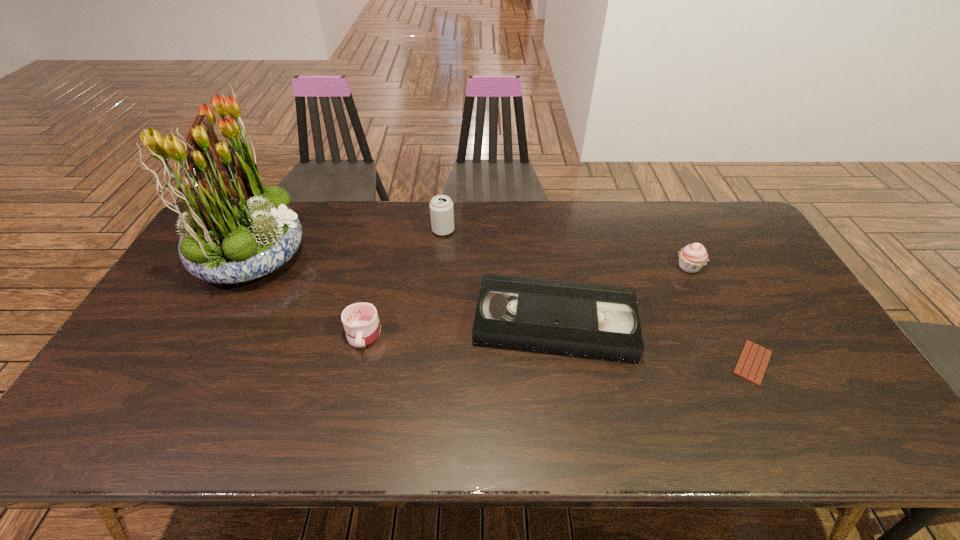
Where is `empty space between the candy bar and the cupcake`? The width and height of the screenshot is (960, 540). empty space between the candy bar and the cupcake is located at coordinates pos(721,315).

The image size is (960, 540). I want to click on free space between the second tallest object and the second object from left to right, so click(x=403, y=282).

This screenshot has height=540, width=960. I want to click on blank region between the mug and the flower arrangement, so click(x=308, y=295).

Locate which object is the fourth closest to the videotape. Please provide its 2D coordinates. Your answer should be formatted as a tuple, i.e. [(x, y)], where the tuple contains the x and y coordinates of a point satisfying the conditions above.

[(361, 323)]

You are a GUI agent. You are given a task and a screenshot of the screen. Output one action in this format:
    pyautogui.click(x=<x>, y=<y>)
    Task: Click on the object that is the second nearest to the third object from left to right
    
    Given the screenshot: What is the action you would take?
    pyautogui.click(x=361, y=323)

This screenshot has width=960, height=540. What are the coordinates of `vacant area in the image that satisfies the following two spatial constraints: 1. on the front-facing side of the tallest object; 2. on the right side of the fourth shortest object` in the screenshot? It's located at 246,267.

Locate an element on the screen. The width and height of the screenshot is (960, 540). free space that satisfies the following two spatial constraints: 1. on the front-facing side of the tallest object; 2. on the right side of the candy bar is located at coordinates (193, 363).

You are a GUI agent. You are given a task and a screenshot of the screen. Output one action in this format:
    pyautogui.click(x=<x>, y=<y>)
    Task: Click on the free location that satisfies the following two spatial constraints: 1. on the front side of the shortest object; 2. on the left side of the can
    The width and height of the screenshot is (960, 540).
    Given the screenshot: What is the action you would take?
    pyautogui.click(x=431, y=363)

At what (x,y) coordinates should I click in order to perform the action: click on vacant space that satisfies the following two spatial constraints: 1. on the side with the handle of the mug; 2. on the left side of the candy bar. Please return your answer as a coordinate pair (x, y). The width and height of the screenshot is (960, 540). Looking at the image, I should click on (357, 363).

Find the location of a particular element. vacant area in the image that satisfies the following two spatial constraints: 1. on the front-facing side of the flower arrangement; 2. on the left side of the fourth object from left to right is located at coordinates (215, 323).